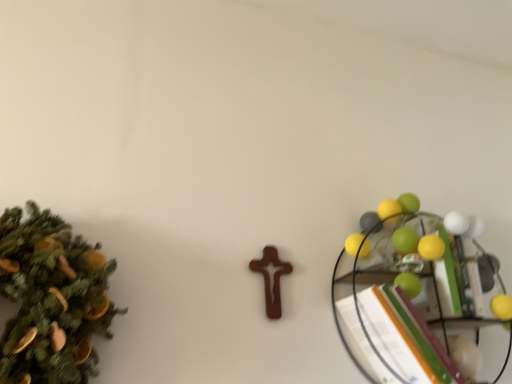
You are a GUI agent. You are given a task and a screenshot of the screen. Output one action in this format:
    pyautogui.click(x=<x>, y=<y>)
    Task: Click on the green matte christmas tree at left
    
    Given the screenshot: What is the action you would take?
    pyautogui.click(x=51, y=299)

What do you see at coordinates (51, 299) in the screenshot? I see `green matte christmas tree at left` at bounding box center [51, 299].

What is the approximate height of green matte christmas tree at left?

It is 36.37 centimeters.

This screenshot has width=512, height=384. What are the coordinates of `metallic wire shelf at right` in the screenshot? It's located at (410, 299).

This screenshot has width=512, height=384. What do you see at coordinates (410, 299) in the screenshot? I see `metallic wire shelf at right` at bounding box center [410, 299].

The image size is (512, 384). What are the coordinates of `green matte christmas tree at left` in the screenshot? It's located at pos(51,299).

Between metallic wire shelf at right and green matte christmas tree at left, which one appears on the right side from the viewer's perspective?

Positioned to the right is metallic wire shelf at right.

Considering the relative positions of metallic wire shelf at right and green matte christmas tree at left in the image provided, is metallic wire shelf at right in front of green matte christmas tree at left?

No, it is behind green matte christmas tree at left.

Is point (469, 248) closer or farther from the camera than point (51, 377)?

Point (469, 248) appears to be farther away from the viewer than point (51, 377).

Looking at this image, from the image's perspective, which is above, metallic wire shelf at right or green matte christmas tree at left?

green matte christmas tree at left appears higher in the image.

From a real-world perspective, is metallic wire shelf at right located higher than green matte christmas tree at left?

Actually, metallic wire shelf at right is physically below green matte christmas tree at left in the real world.

Can you confirm if metallic wire shelf at right is wider than green matte christmas tree at left?

In fact, metallic wire shelf at right might be narrower than green matte christmas tree at left.

Does metallic wire shelf at right have a greater height compared to green matte christmas tree at left?

Indeed, metallic wire shelf at right has a greater height compared to green matte christmas tree at left.

Which of these two, metallic wire shelf at right or green matte christmas tree at left, is bigger?

Bigger between the two is metallic wire shelf at right.

Choose the correct answer: Is metallic wire shelf at right inside green matte christmas tree at left or outside it?

The correct answer is: outside.

Is the surface of metallic wire shelf at right in direct contact with green matte christmas tree at left?

No, metallic wire shelf at right is not next to green matte christmas tree at left.

Could you tell me if metallic wire shelf at right is facing green matte christmas tree at left?

No, metallic wire shelf at right does not turn towards green matte christmas tree at left.

I want to click on shelf lying below the green matte christmas tree at left (from the image's perspective), so click(x=410, y=299).

Visually, is green matte christmas tree at left positioned to the left or to the right of metallic wire shelf at right?

green matte christmas tree at left is to the left of metallic wire shelf at right.

Is green matte christmas tree at left positioned in front of metallic wire shelf at right?

Yes, green matte christmas tree at left is in front of metallic wire shelf at right.

Is point (41, 319) in front of point (446, 350)?

Yes, it is in front of point (446, 350).

From the image's perspective, does green matte christmas tree at left appear higher than metallic wire shelf at right?

Yes, from the image's perspective, green matte christmas tree at left is on top of metallic wire shelf at right.

From a real-world perspective, which is physically above, green matte christmas tree at left or metallic wire shelf at right?

green matte christmas tree at left.

Is green matte christmas tree at left thinner than metallic wire shelf at right?

Incorrect, the width of green matte christmas tree at left is not less than that of metallic wire shelf at right.

Is green matte christmas tree at left taller than metallic wire shelf at right?

No.

Which of these two, green matte christmas tree at left or metallic wire shelf at right, is smaller?

green matte christmas tree at left is smaller.

Do you think green matte christmas tree at left is within metallic wire shelf at right, or outside of it?

green matte christmas tree at left cannot be found inside metallic wire shelf at right.

Is green matte christmas tree at left touching metallic wire shelf at right?

No, green matte christmas tree at left is not next to metallic wire shelf at right.

Could you tell me if green matte christmas tree at left is facing metallic wire shelf at right?

No.

Can you tell me how much green matte christmas tree at left and metallic wire shelf at right differ in facing direction?

0.000566 degrees separate the facing orientations of green matte christmas tree at left and metallic wire shelf at right.

How much distance is there between green matte christmas tree at left and metallic wire shelf at right?

A distance of 25.48 inches exists between green matte christmas tree at left and metallic wire shelf at right.

In the image, there is a metallic wire shelf at right. Find the location of `christmas tree above it (from the image's perspective)`. christmas tree above it (from the image's perspective) is located at coordinates (51, 299).

Where is `shelf that is on the right side of green matte christmas tree at left`? Image resolution: width=512 pixels, height=384 pixels. shelf that is on the right side of green matte christmas tree at left is located at coordinates (410, 299).

Locate an element on the screen. The image size is (512, 384). christmas tree above the metallic wire shelf at right (from the image's perspective) is located at coordinates (51, 299).